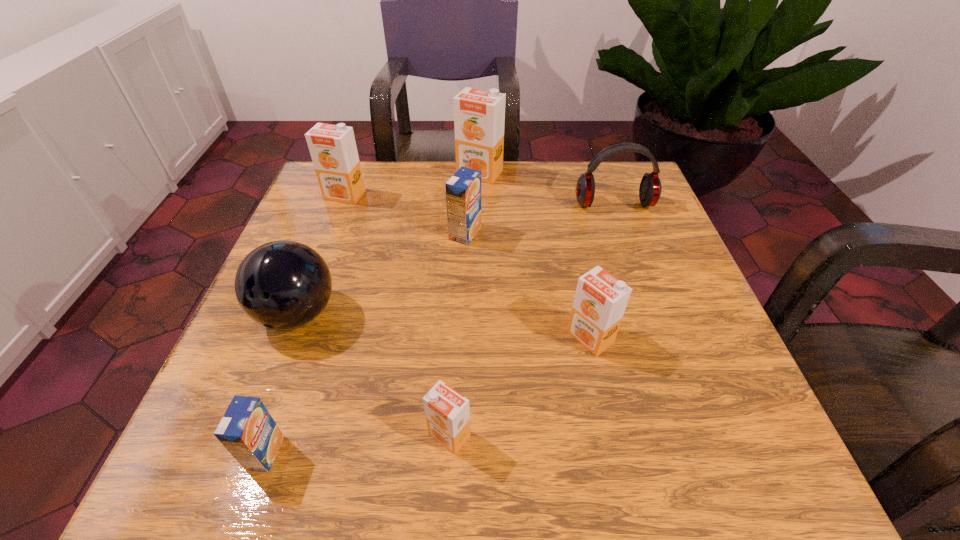
Where is `free space at the right edge of the desktop`? The width and height of the screenshot is (960, 540). free space at the right edge of the desktop is located at coordinates (658, 286).

Locate an element on the screen. This screenshot has width=960, height=540. vacant space at the far left corner of the desktop is located at coordinates (366, 162).

Locate an element on the screen. The image size is (960, 540). vacant position at the near left corner of the desktop is located at coordinates (277, 464).

At what (x,y) coordinates should I click in order to perform the action: click on free space at the far right corner of the desktop. Please return your answer as a coordinate pair (x, y). Looking at the image, I should click on (597, 178).

Locate an element on the screen. The image size is (960, 540). free location at the near right corner is located at coordinates (712, 468).

At what (x,y) coordinates should I click in order to perform the action: click on unoccupied area between the tallest object and the smallest orange orange juice. Please return your answer as a coordinate pair (x, y). Image resolution: width=960 pixels, height=540 pixels. Looking at the image, I should click on (465, 304).

In order to click on vacant space that's between the bowling ball and the farthest orange_juice in this screenshot , I will do `click(389, 244)`.

Image resolution: width=960 pixels, height=540 pixels. In order to click on empty space that is in between the third farthest orange_juice and the black bowling ball in this screenshot , I will do `click(381, 274)`.

This screenshot has width=960, height=540. What are the coordinates of `vacant area between the nearest orange orange juice and the nearer blue orange_juice` in the screenshot? It's located at (357, 444).

This screenshot has width=960, height=540. In order to click on vacant area that lies between the farthest orange orange juice and the left blue orange_juice in this screenshot , I will do `click(372, 313)`.